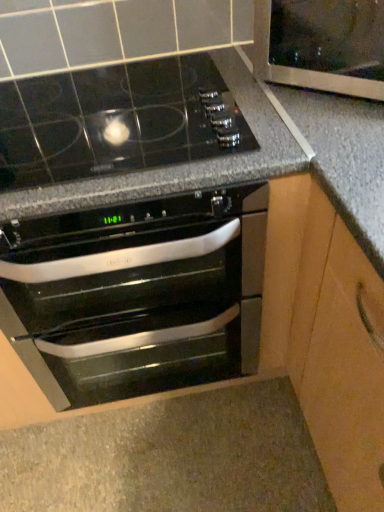
Question: Is transparent glass door at upper right at the back of black glass oven at center?

Choices:
 (A) no
 (B) yes

Answer: (A)

Question: Is black glass oven at center not within transparent glass door at upper right?

Choices:
 (A) yes
 (B) no

Answer: (A)

Question: From a real-world perspective, is black glass oven at center on transparent glass door at upper right?

Choices:
 (A) yes
 (B) no

Answer: (B)

Question: Considering the relative sizes of black glass oven at center and transparent glass door at upper right in the image provided, is black glass oven at center wider than transparent glass door at upper right?

Choices:
 (A) no
 (B) yes

Answer: (B)

Question: Is black glass oven at center not close to transparent glass door at upper right?

Choices:
 (A) yes
 (B) no

Answer: (B)

Question: From the image's perspective, is black glass oven at center below transparent glass door at upper right?

Choices:
 (A) yes
 (B) no

Answer: (A)

Question: Is black glass oven at center completely or partially inside transparent glass door at upper right?

Choices:
 (A) yes
 (B) no

Answer: (B)

Question: From the image's perspective, would you say transparent glass door at upper right is positioned over black glass oven at center?

Choices:
 (A) no
 (B) yes

Answer: (B)

Question: Is transparent glass door at upper right looking in the opposite direction of black glass oven at center?

Choices:
 (A) no
 (B) yes

Answer: (A)

Question: Does transparent glass door at upper right have a larger size compared to black glass oven at center?

Choices:
 (A) yes
 (B) no

Answer: (B)

Question: Considering the relative sizes of transparent glass door at upper right and black glass oven at center in the image provided, is transparent glass door at upper right smaller than black glass oven at center?

Choices:
 (A) no
 (B) yes

Answer: (B)

Question: Is transparent glass door at upper right to the left of black glass oven at center from the viewer's perspective?

Choices:
 (A) no
 (B) yes

Answer: (A)

Question: From the image's perspective, relative to black glass oven at center, is transparent glass door at upper right above or below?

Choices:
 (A) above
 (B) below

Answer: (A)